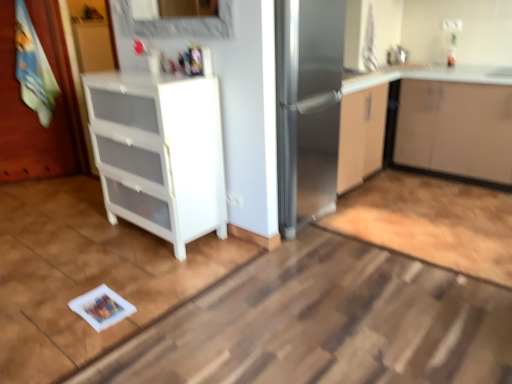
Question: Is matte white cabinet at upper right, positioned as the 1th cabinetry in right-to-left order, in front of or behind white plastic drawer unit at left, positioned as the 1th cabinetry in left-to-right order, in the image?

Choices:
 (A) behind
 (B) front

Answer: (A)

Question: From a real-world perspective, is matte white cabinet at upper right, which ranks as the second cabinetry in left-to-right order, physically located above or below white plastic drawer unit at left, the 2th cabinetry positioned from the right?

Choices:
 (A) above
 (B) below

Answer: (B)

Question: Considering the real-world distances, which object is closest to the stainless steel fridge at center?

Choices:
 (A) white plastic drawer at center
 (B) white plastic drawer unit at left, positioned as the 1th cabinetry in left-to-right order
 (C) matte white cabinet at upper right, positioned as the 1th cabinetry in right-to-left order
 (D) wooden painted door at left

Answer: (B)

Question: Estimate the real-world distances between objects in this image. Which object is closer to the white plastic drawer at center?

Choices:
 (A) wooden painted door at left
 (B) white plastic drawer unit at left, the 2th cabinetry positioned from the right
 (C) matte white cabinet at upper right, positioned as the 1th cabinetry in right-to-left order
 (D) stainless steel fridge at center

Answer: (B)